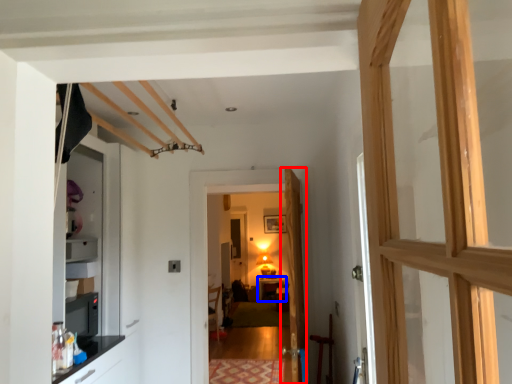
Question: Among these objects, which one is farthest to the camera, door (highlighted by a red box) or table (highlighted by a blue box)?

Choices:
 (A) door
 (B) table

Answer: (B)